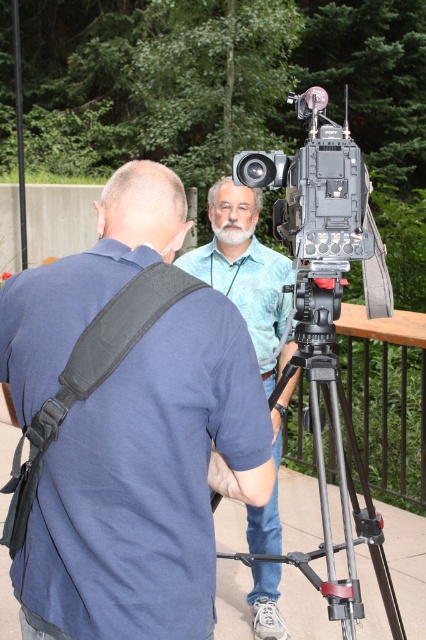
You are a photographer trying to set up a shot. You need to place a red marker exactly where the blue cotton shirt at upper left is located. According to the coordinates provided, where should you place the red marker?

The blue cotton shirt at upper left is located at point (147,484), so you should place the red marker at those coordinates.